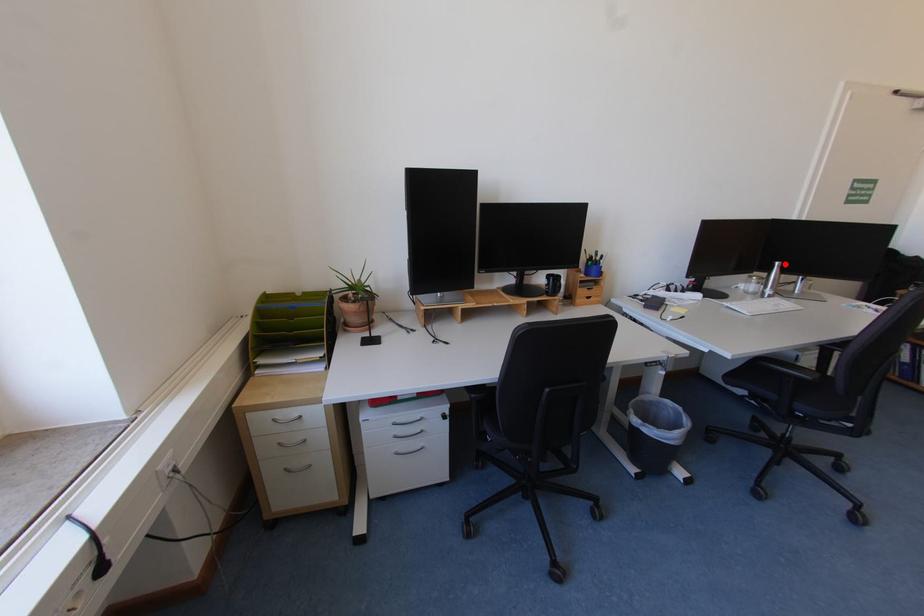
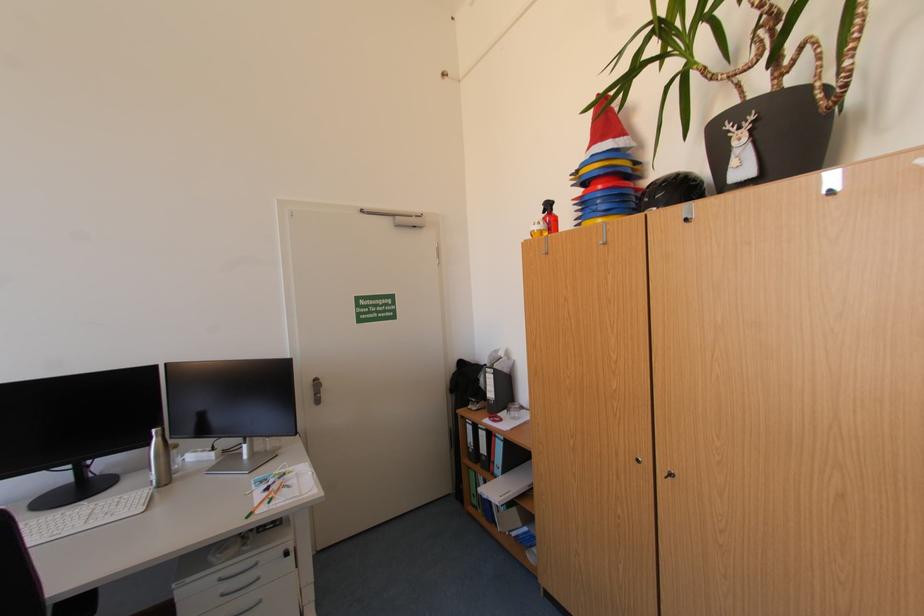
The point at the highlighted location is marked in the first image. Where is the corresponding point in the second image?

(161, 431)